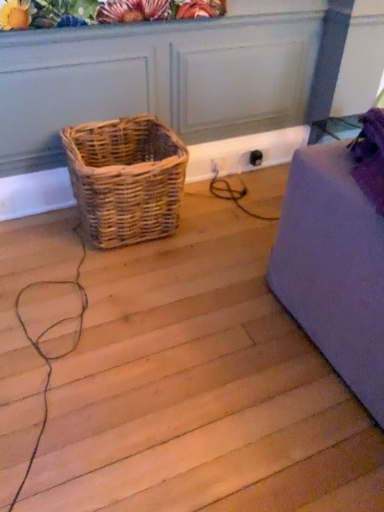
What is the approximate height of woven natural basket at center-left?

It is 46.90 centimeters.

I want to click on woven natural basket at center-left, so click(x=126, y=178).

This screenshot has height=512, width=384. What do you see at coordinates (126, 178) in the screenshot? I see `woven natural basket at center-left` at bounding box center [126, 178].

Where is `matte floral arrangement at upper center`? Image resolution: width=384 pixels, height=512 pixels. matte floral arrangement at upper center is located at coordinates (103, 11).

The height and width of the screenshot is (512, 384). What do you see at coordinates (103, 11) in the screenshot?
I see `matte floral arrangement at upper center` at bounding box center [103, 11].

Find the location of a particular element. This screenshot has height=512, width=384. woven natural basket at center-left is located at coordinates (126, 178).

Is woven natural basket at center-left to the left of matte floral arrangement at upper center from the viewer's perspective?

Correct, you'll find woven natural basket at center-left to the left of matte floral arrangement at upper center.

Which is in front, woven natural basket at center-left or matte floral arrangement at upper center?

matte floral arrangement at upper center is more forward.

Which is behind, point (167, 176) or point (186, 6)?

Point (186, 6)

From the image's perspective, is woven natural basket at center-left under matte floral arrangement at upper center?

Indeed, from the image's perspective, woven natural basket at center-left is shown beneath matte floral arrangement at upper center.

From a real-world perspective, who is located lower, woven natural basket at center-left or matte floral arrangement at upper center?

woven natural basket at center-left.

Which object is thinner, woven natural basket at center-left or matte floral arrangement at upper center?

With smaller width is matte floral arrangement at upper center.

Looking at this image, considering the sizes of objects woven natural basket at center-left and matte floral arrangement at upper center in the image provided, who is taller, woven natural basket at center-left or matte floral arrangement at upper center?

woven natural basket at center-left.

Which of these two, woven natural basket at center-left or matte floral arrangement at upper center, is bigger?

woven natural basket at center-left.

Can we say woven natural basket at center-left lies outside matte floral arrangement at upper center?

woven natural basket at center-left is positioned outside matte floral arrangement at upper center.

Are woven natural basket at center-left and matte floral arrangement at upper center beside each other?

There is a gap between woven natural basket at center-left and matte floral arrangement at upper center.

Is woven natural basket at center-left facing towards matte floral arrangement at upper center?

No.

How many degrees apart are the facing directions of woven natural basket at center-left and matte floral arrangement at upper center?

There is a 88.6-degree angle between the facing directions of woven natural basket at center-left and matte floral arrangement at upper center.

Locate an element on the screen. This screenshot has height=512, width=384. picnic basket that appears below the matte floral arrangement at upper center (from the image's perspective) is located at coordinates (126, 178).

Between matte floral arrangement at upper center and woven natural basket at center-left, which one appears on the right side from the viewer's perspective?

matte floral arrangement at upper center is more to the right.

Which is behind, matte floral arrangement at upper center or woven natural basket at center-left?

woven natural basket at center-left.

Is point (180, 8) in front of point (77, 159)?

No, it is not.

From the image's perspective, would you say matte floral arrangement at upper center is positioned over woven natural basket at center-left?

Correct, matte floral arrangement at upper center appears higher than woven natural basket at center-left in the image.

From a real-world perspective, between matte floral arrangement at upper center and woven natural basket at center-left, who is vertically higher?

From a 3D spatial view, matte floral arrangement at upper center is above.

Which of these two, matte floral arrangement at upper center or woven natural basket at center-left, is thinner?

matte floral arrangement at upper center is thinner.

Who is shorter, matte floral arrangement at upper center or woven natural basket at center-left?

With less height is matte floral arrangement at upper center.

Which of these two, matte floral arrangement at upper center or woven natural basket at center-left, is smaller?

With smaller size is matte floral arrangement at upper center.

Is matte floral arrangement at upper center completely or partially outside of woven natural basket at center-left?

matte floral arrangement at upper center is positioned outside woven natural basket at center-left.

Looking at this image, would you say matte floral arrangement at upper center is a long distance from woven natural basket at center-left?

That's not correct — matte floral arrangement at upper center is a little close to woven natural basket at center-left.

Is matte floral arrangement at upper center oriented towards woven natural basket at center-left?

No, matte floral arrangement at upper center does not turn towards woven natural basket at center-left.

How many degrees apart are the facing directions of matte floral arrangement at upper center and woven natural basket at center-left?

matte floral arrangement at upper center and woven natural basket at center-left are facing 88.6 degrees away from each other.

How far apart are matte floral arrangement at upper center and woven natural basket at center-left?

25.84 inches.

You are a GUI agent. You are given a task and a screenshot of the screen. Output one action in this format:
    pyautogui.click(x=<x>, y=<y>)
    Task: Click on the picnic basket that appears below the matte floral arrangement at upper center (from the image's perspective)
    This screenshot has height=512, width=384.
    Given the screenshot: What is the action you would take?
    pyautogui.click(x=126, y=178)

At what (x,y) coordinates should I click in order to perform the action: click on picnic basket located below the matte floral arrangement at upper center (from the image's perspective). Please return your answer as a coordinate pair (x, y). Looking at the image, I should click on (126, 178).

The image size is (384, 512). I want to click on floral arrangement on the right side of woven natural basket at center-left, so click(x=103, y=11).